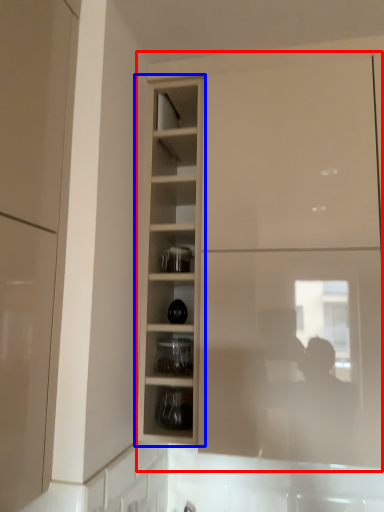
Question: Which object is closer to the camera taking this photo, cabinetry (highlighted by a red box) or cupboard (highlighted by a blue box)?

Choices:
 (A) cabinetry
 (B) cupboard

Answer: (A)